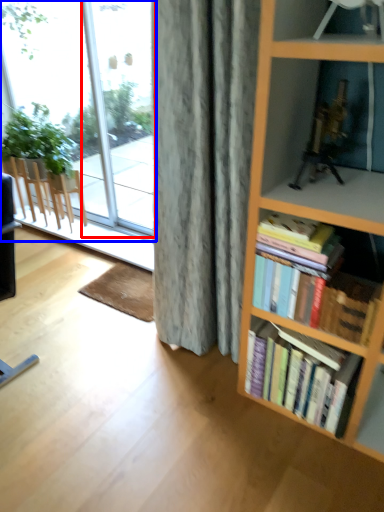
Question: Which object is closer to the camera taking this photo, glass door (highlighted by a red box) or window (highlighted by a blue box)?

Choices:
 (A) glass door
 (B) window

Answer: (A)